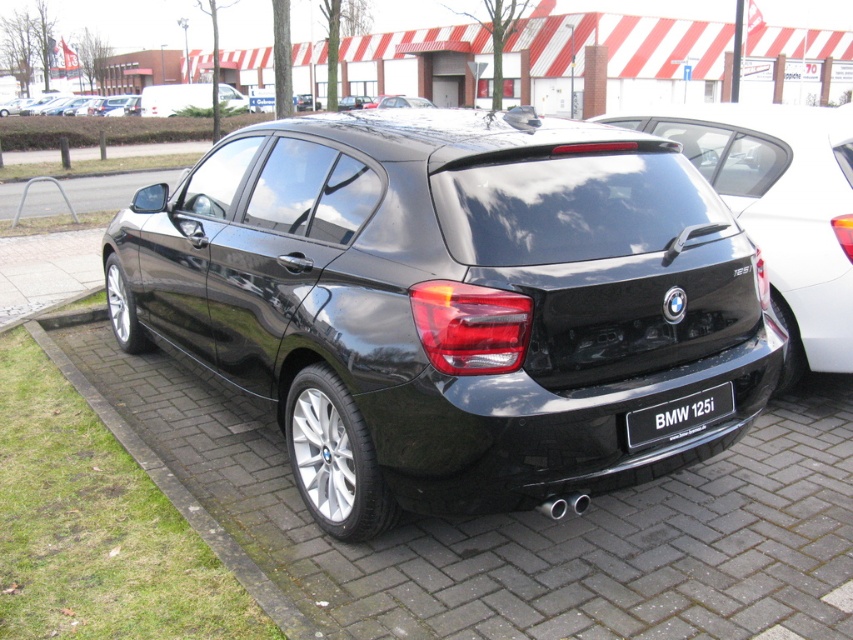
You are a delivery person trying to park a delivery van that is 2 meters long. You see the black glossy hatchback at center and the black concrete curb at lower left. Can you safely park your van between them without hitting either?

The black glossy hatchback at center is further to the viewer than the black concrete curb at lower left. Since the distance between them isn generated by the model but not provided in the Objects Description, the model cannot determine if the van can fit safely. Please check the actual distance between the two objects.

You are a photographer trying to capture the BMW 125i in the image. You want to ensure that both the glossy black car at center and the black plastic license plate at center are clearly visible in your shot. Given their sizes, which object should you focus on first to ensure proper framing?

The glossy black car at center is bigger than the black plastic license plate at center, so you should focus on the glossy black car at center first to ensure proper framing.